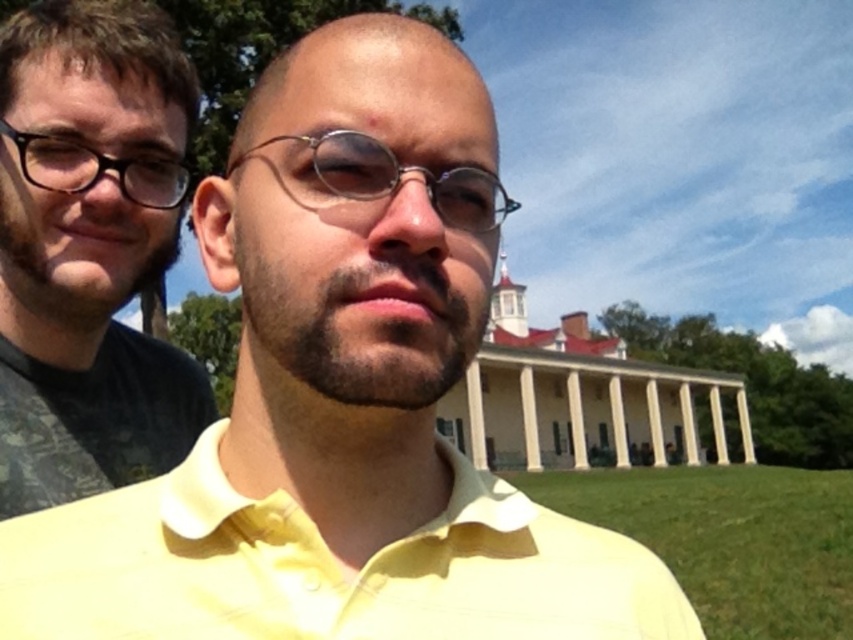
Question: Is yellow cotton polo shirt at center further to the viewer compared to metallic round glasses at center?

Choices:
 (A) yes
 (B) no

Answer: (B)

Question: Where is metallic round glasses at center located in relation to matte black glasses at left in the image?

Choices:
 (A) above
 (B) below

Answer: (B)

Question: Is the position of yellow cotton polo shirt at center more distant than that of matte black shirt at left?

Choices:
 (A) no
 (B) yes

Answer: (A)

Question: Which object appears closest to the camera in this image?

Choices:
 (A) metallic round glasses at center
 (B) matte black glasses at left
 (C) yellow cotton polo shirt at center
 (D) matte black shirt at left

Answer: (C)

Question: Which point is closer to the camera?

Choices:
 (A) matte black glasses at left
 (B) matte black shirt at left

Answer: (B)

Question: Which object is farther from the camera taking this photo?

Choices:
 (A) matte black glasses at left
 (B) matte black shirt at left

Answer: (A)